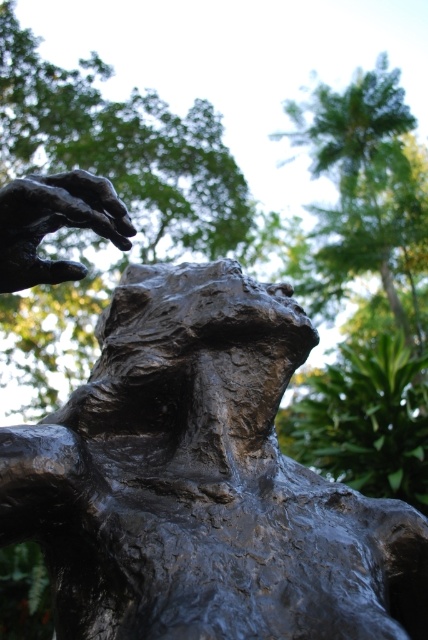
Question: Is bronze sculpture at center behind bronze textured hand at upper left?

Choices:
 (A) no
 (B) yes

Answer: (A)

Question: Does bronze sculpture at center have a smaller size compared to bronze textured hand at upper left?

Choices:
 (A) no
 (B) yes

Answer: (A)

Question: Is bronze sculpture at center to the right of bronze textured hand at upper left from the viewer's perspective?

Choices:
 (A) yes
 (B) no

Answer: (A)

Question: Which point is farther to the camera?

Choices:
 (A) bronze sculpture at center
 (B) bronze textured hand at upper left

Answer: (B)